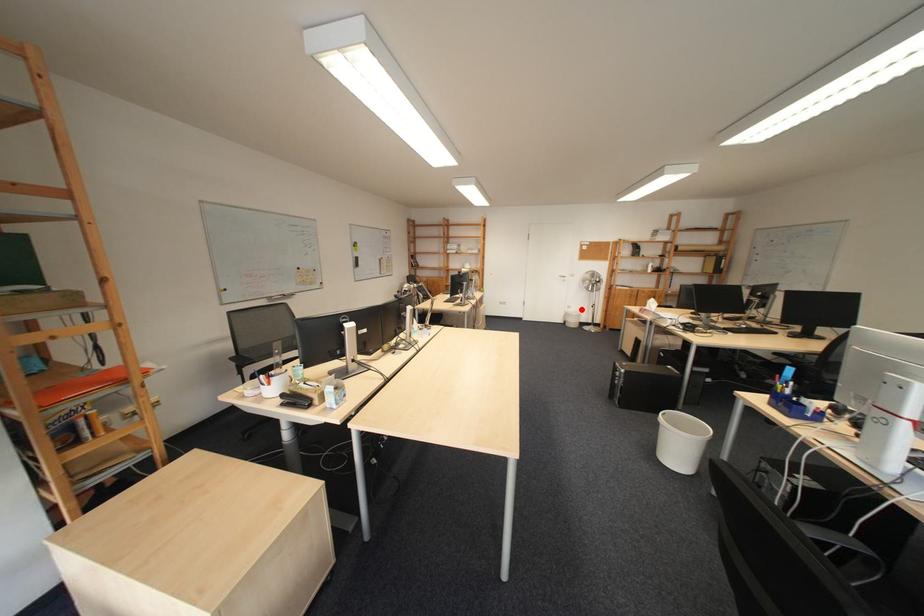
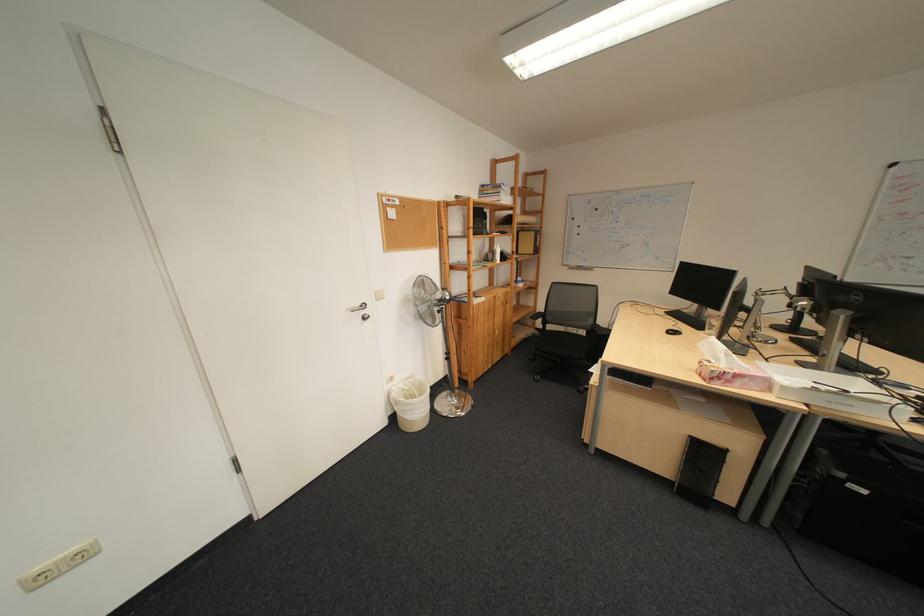
In the second image, find the point that corresponds to the highlighted location in the first image.

(402, 386)